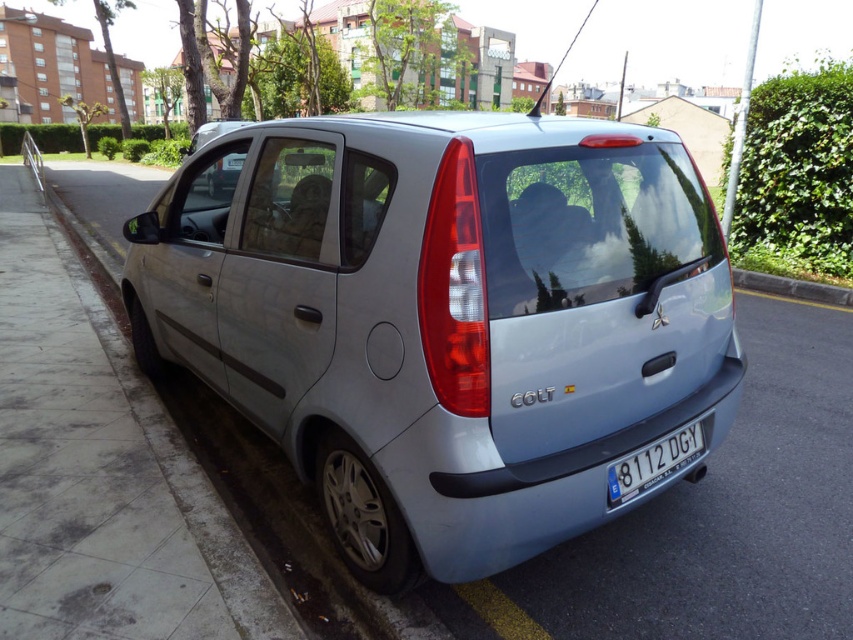
You are a pedestrian standing on the sidewalk. You see the satin silver car at center and the white plastic license plate at center. Which object is nearer to you?

The satin silver car at center is closer to the viewer than the white plastic license plate at center, so the satin silver car at center is nearer to you.